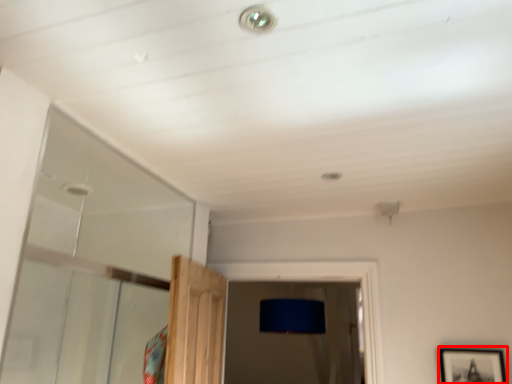
Question: In this image, where is picture frame (annotated by the red box) located relative to droplight?

Choices:
 (A) right
 (B) left

Answer: (A)